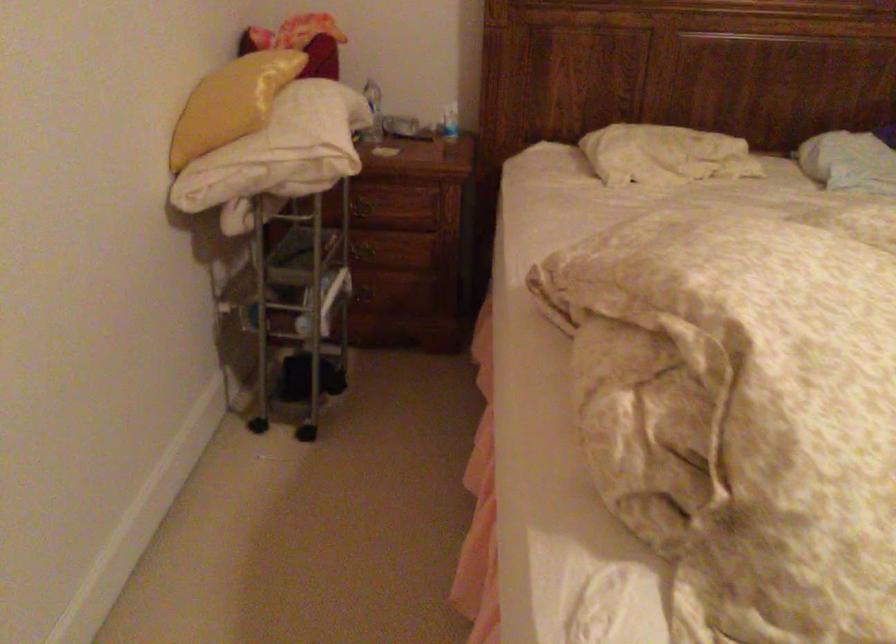
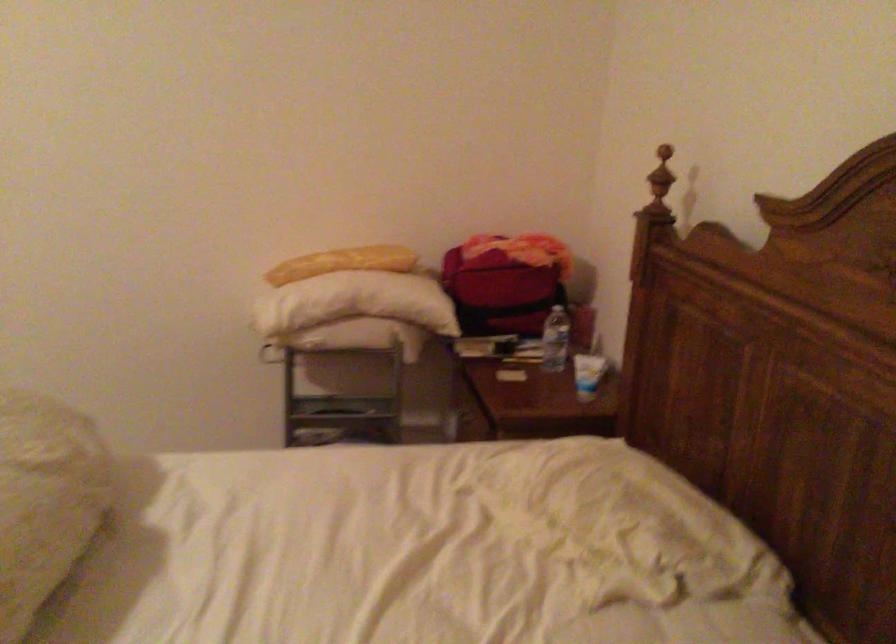
Find the pixel in the second image that matches pixel 393 109 in the first image.

(556, 339)